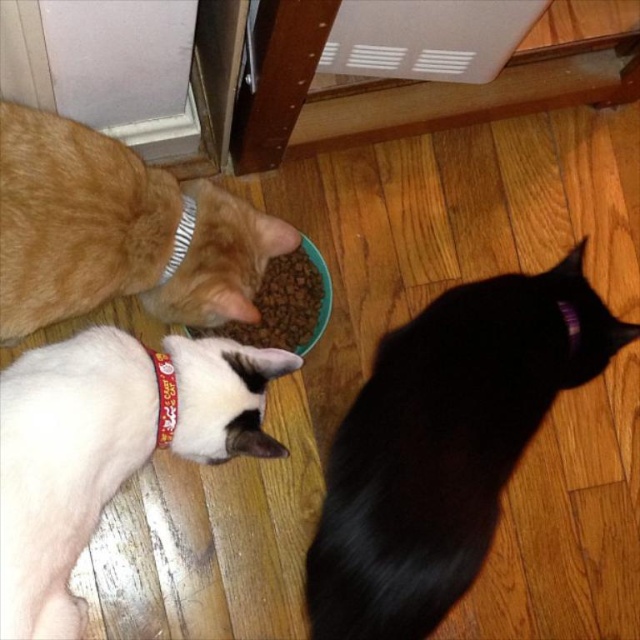
Who is more distant from viewer, (65, 356) or (84, 308)?

The point (84, 308) is behind.

Can you confirm if white fur cat at lower left is positioned above orange fur cat at left?

Actually, white fur cat at lower left is below orange fur cat at left.

Between point (125, 332) and point (256, 241), which one is positioned in front?

Point (256, 241) is more forward.

Image resolution: width=640 pixels, height=640 pixels. In order to click on white fur cat at lower left in this screenshot , I will do `click(106, 448)`.

Who is positioned more to the right, black silky cat at lower right or orange fur cat at left?

Positioned to the right is black silky cat at lower right.

Between point (552, 291) and point (24, 314), which one is positioned in front?

Point (24, 314)

Where is `black silky cat at lower right`? black silky cat at lower right is located at coordinates (444, 444).

Can you confirm if orange fur cat at left is bigger than dry kibble at center?

Yes.

Between point (108, 164) and point (285, 326), which one is positioned behind?

The point (285, 326) is more distant.

Is point (100, 188) positioned behind point (301, 252)?

No, (100, 188) is closer to viewer.

The image size is (640, 640). I want to click on orange fur cat at left, so click(x=116, y=230).